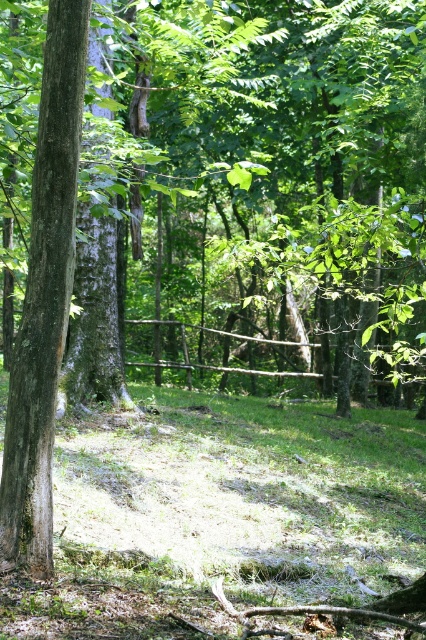
You are standing in the forest and see the smooth brown tree trunk at left and the brown wooden fence at center. Which object is nearer to you?

The smooth brown tree trunk at left is closer to the viewer than the brown wooden fence at center.